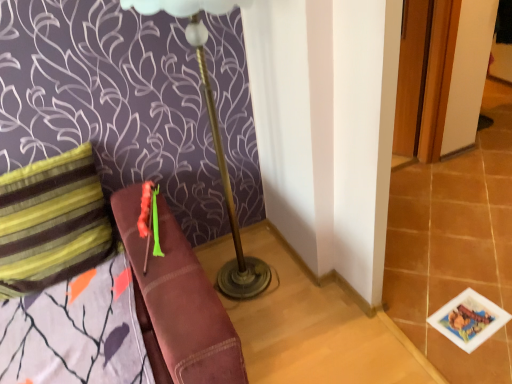
Question: Is striped fabric pillow at left inside or outside of printed paper card at lower right?

Choices:
 (A) outside
 (B) inside

Answer: (A)

Question: From a real-world perspective, is striped fabric pillow at left physically located above or below printed paper card at lower right?

Choices:
 (A) above
 (B) below

Answer: (A)

Question: Considering the real-world distances, which object is farthest from the striped fabric pillow at left?

Choices:
 (A) printed paper card at lower right
 (B) metallic gold table lamp at center

Answer: (A)

Question: Which object is positioned farthest from the metallic gold table lamp at center?

Choices:
 (A) striped fabric pillow at left
 (B) printed paper card at lower right

Answer: (B)